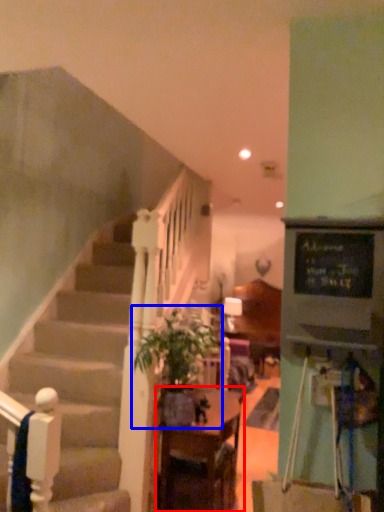
Question: Which point is closer to the camera, table (highlighted by a red box) or houseplant (highlighted by a blue box)?

Choices:
 (A) table
 (B) houseplant

Answer: (B)